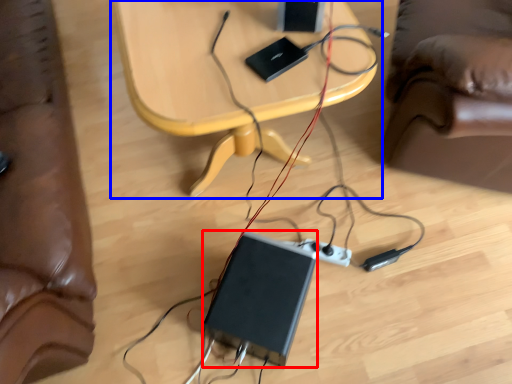
Question: Which object appears closest to the camera in this image, computer (highlighted by a red box) or table (highlighted by a blue box)?

Choices:
 (A) computer
 (B) table

Answer: (B)